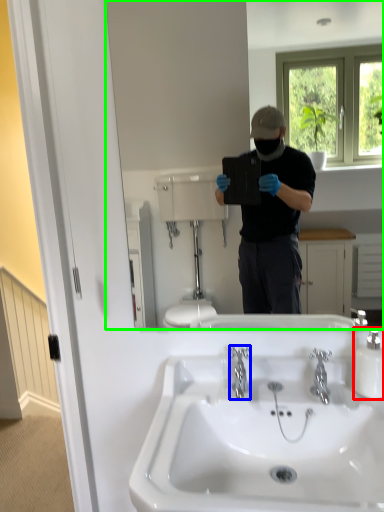
Question: Which is nearer to the bottle (highlighted by a red box)? plumbing fixture (highlighted by a blue box) or mirror (highlighted by a green box).

Choices:
 (A) plumbing fixture
 (B) mirror

Answer: (A)